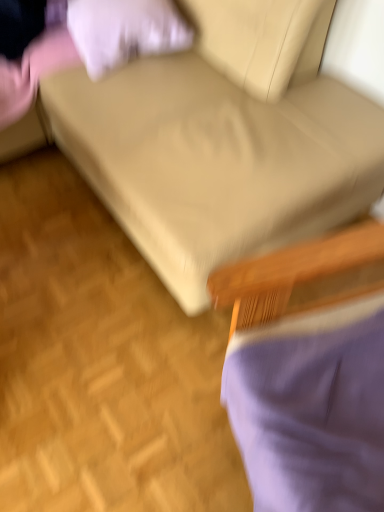
Question: Can you confirm if white soft pillow at upper left is shorter than purple fabric chair at lower right?

Choices:
 (A) yes
 (B) no

Answer: (A)

Question: Is white soft pillow at upper left next to purple fabric chair at lower right and touching it?

Choices:
 (A) yes
 (B) no

Answer: (B)

Question: Does white soft pillow at upper left have a smaller size compared to purple fabric chair at lower right?

Choices:
 (A) yes
 (B) no

Answer: (A)

Question: Is white soft pillow at upper left looking in the opposite direction of purple fabric chair at lower right?

Choices:
 (A) yes
 (B) no

Answer: (B)

Question: Is white soft pillow at upper left thinner than purple fabric chair at lower right?

Choices:
 (A) no
 (B) yes

Answer: (B)

Question: From the image's perspective, is white soft pillow at upper left above purple fabric chair at lower right?

Choices:
 (A) no
 (B) yes

Answer: (B)

Question: Considering the relative sizes of purple fabric chair at lower right and white soft pillow at upper left in the image provided, is purple fabric chair at lower right wider than white soft pillow at upper left?

Choices:
 (A) no
 (B) yes

Answer: (B)

Question: Can white soft pillow at upper left be found inside purple fabric chair at lower right?

Choices:
 (A) no
 (B) yes

Answer: (A)

Question: Is purple fabric chair at lower right at the left side of white soft pillow at upper left?

Choices:
 (A) yes
 (B) no

Answer: (B)

Question: Is purple fabric chair at lower right bigger than white soft pillow at upper left?

Choices:
 (A) yes
 (B) no

Answer: (A)

Question: Can we say purple fabric chair at lower right lies outside white soft pillow at upper left?

Choices:
 (A) no
 (B) yes

Answer: (B)

Question: Considering the relative sizes of purple fabric chair at lower right and white soft pillow at upper left in the image provided, is purple fabric chair at lower right taller than white soft pillow at upper left?

Choices:
 (A) yes
 (B) no

Answer: (A)

Question: Does beige fabric couch at center have a greater height compared to purple fabric chair at lower right?

Choices:
 (A) yes
 (B) no

Answer: (A)